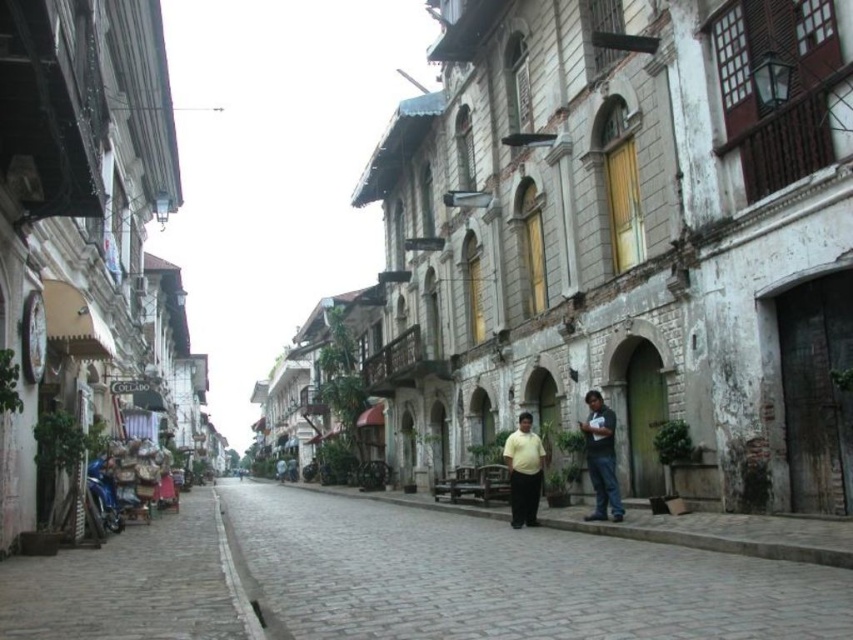
Based on the photo, you are a delivery person carrying a package and need to reach the yellow matte shirt at center from the brown cobblestone pavement at center. The delivery robot you are using has a maximum operating range of 15 meters. Can you make the delivery without exceeding the robot s range?

The distance between the brown cobblestone pavement at center and the yellow matte shirt at center is 15.33 meters, which exceeds the robot s 15 meter range. Therefore, the delivery cannot be made without exceeding the robot s operating range.